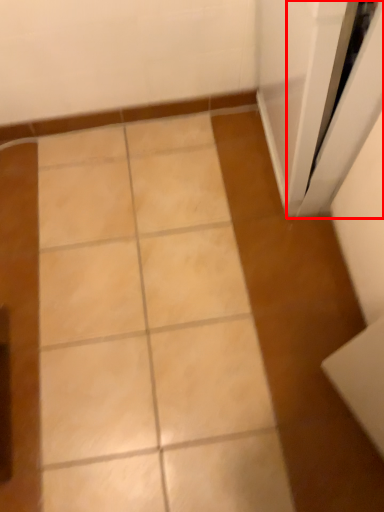
Question: In this image, where is screen door (annotated by the red box) located relative to ceramic tile?

Choices:
 (A) left
 (B) right

Answer: (B)